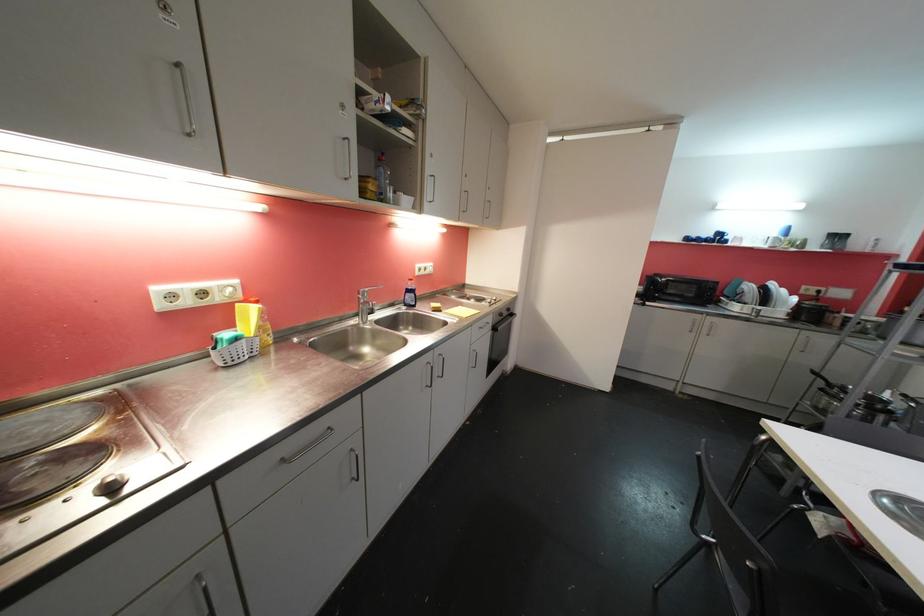
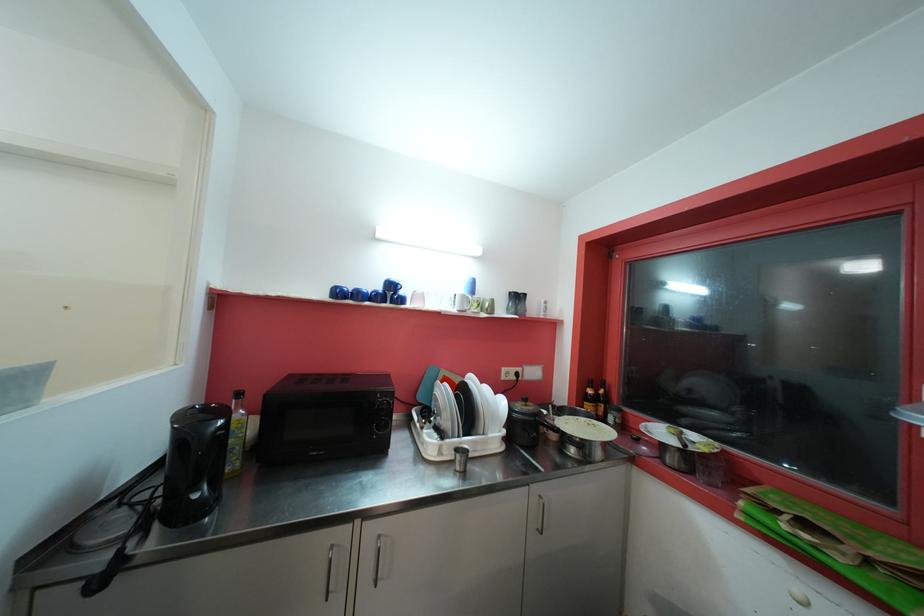
Where in the second image is the point corresponding to the point at 724,237 from the first image?

(396, 288)